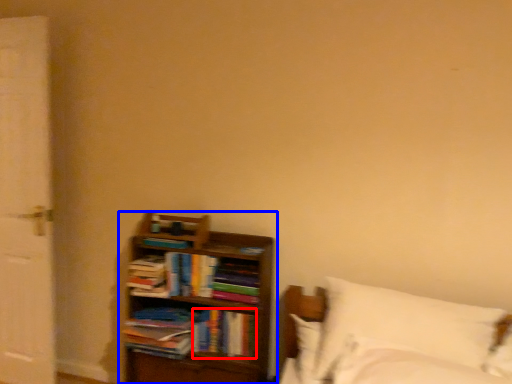
Question: Which object appears farthest to the camera in this image, book (highlighted by a red box) or bookcase (highlighted by a blue box)?

Choices:
 (A) book
 (B) bookcase

Answer: (A)